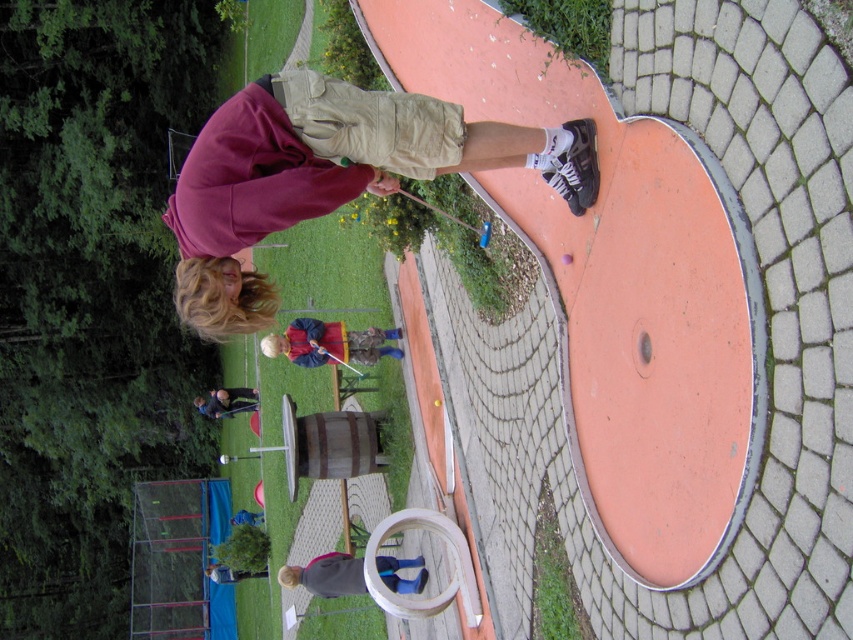
Based on the scene description, where is the maroon fleece jacket at upper left located in terms of coordinates?

The maroon fleece jacket at upper left is located at coordinates point (x=329, y=176).

You are standing at the center of the circular orange platform and want to hit the golf ball towards the flag located at the edge of the course. The flag is marked by the point at coordinates point [329,176]. Which direction should you aim to hit the ball to reach the flag?

The point [329,176] is on the maroon fleece jacket at upper left, so you should aim towards the upper left direction to hit the ball towards the flag.